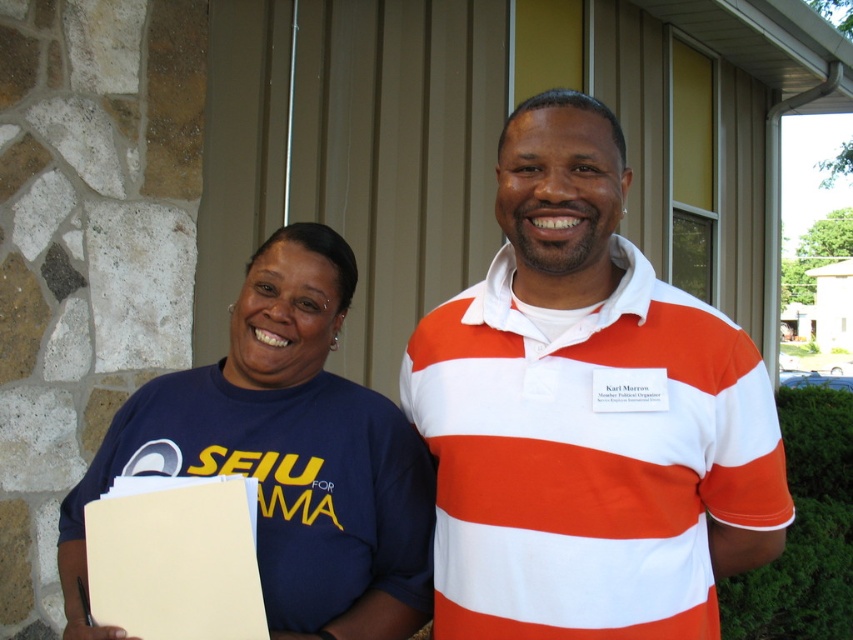
Question: From the image, what is the correct spatial relationship of white striped polo shirt at center in relation to blue t-shirt at left?

Choices:
 (A) right
 (B) left

Answer: (A)

Question: Which point is closer to the camera?

Choices:
 (A) (332, 620)
 (B) (543, 225)

Answer: (B)

Question: Which object appears closest to the camera in this image?

Choices:
 (A) blue t-shirt at left
 (B) white striped polo shirt at center

Answer: (A)

Question: Is white striped polo shirt at center positioned at the back of blue t-shirt at left?

Choices:
 (A) yes
 (B) no

Answer: (A)

Question: Is white striped polo shirt at center below blue t-shirt at left?

Choices:
 (A) yes
 (B) no

Answer: (B)